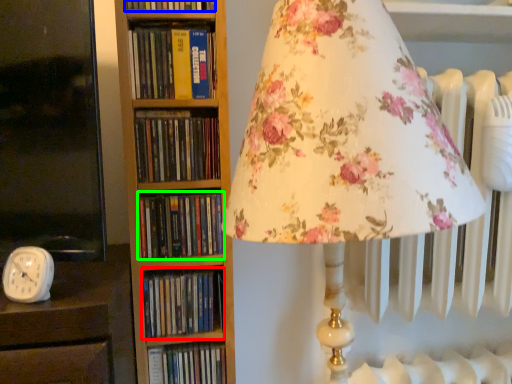
Question: Considering the real-world distances, which object is farthest from book (highlighted by a red box)? book (highlighted by a blue box) or book (highlighted by a green box)?

Choices:
 (A) book
 (B) book

Answer: (A)